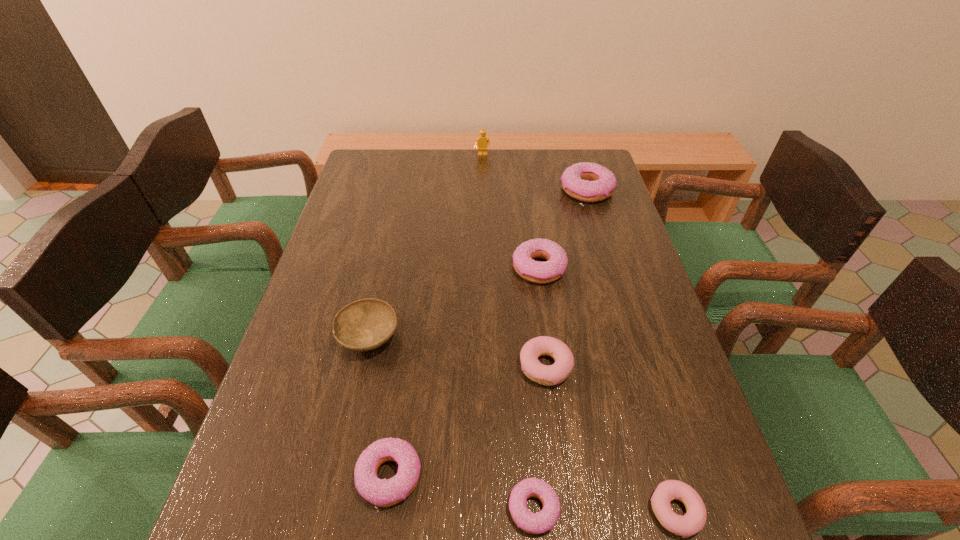
This screenshot has height=540, width=960. I want to click on vacant space located on the back of the smaller pink doughnut, so click(x=624, y=333).

The height and width of the screenshot is (540, 960). Find the location of `blank area located on the back of the smallest purple doughnut`. blank area located on the back of the smallest purple doughnut is located at coordinates (520, 342).

Where is `Lego that is at the far edge`? This screenshot has width=960, height=540. Lego that is at the far edge is located at coordinates (482, 141).

You are a GUI agent. You are given a task and a screenshot of the screen. Output one action in this format:
    pyautogui.click(x=<x>, y=<y>)
    Task: Click on the doughnut located in the far edge section of the desktop
    This screenshot has width=960, height=540.
    Given the screenshot: What is the action you would take?
    pyautogui.click(x=588, y=182)

Locate an element on the screen. The image size is (960, 540). object that is at the near edge is located at coordinates (693, 521).

The height and width of the screenshot is (540, 960). Identify the location of object at the left edge. (366, 324).

Where is `object situated at the far right corner`? Image resolution: width=960 pixels, height=540 pixels. object situated at the far right corner is located at coordinates (588, 182).

What are the coordinates of `object that is at the near right corner` in the screenshot? It's located at (693, 521).

In the image, there is a desktop. Identify the location of free region at the far edge. Image resolution: width=960 pixels, height=540 pixels. (486, 185).

Locate an element on the screen. free spot at the left edge of the desktop is located at coordinates (324, 396).